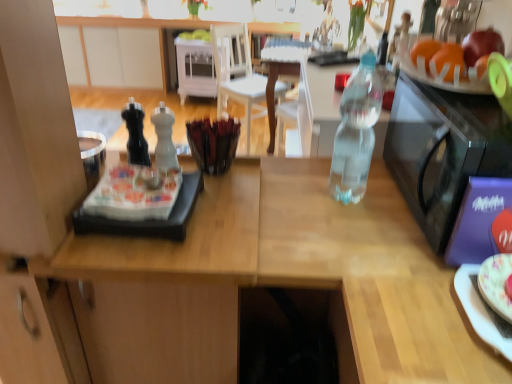
Question: From a real-world perspective, is porcelain floral plate at right positioned above or below white wood chair at center?

Choices:
 (A) above
 (B) below

Answer: (A)

Question: Considering the relative positions of porcelain floral plate at right and white wood chair at center in the image provided, is porcelain floral plate at right to the left or to the right of white wood chair at center?

Choices:
 (A) right
 (B) left

Answer: (A)

Question: Estimate the real-world distances between objects in this image. Which object is farther from the white matte pepper shaker at center, which is the second bottle in right-to-left order?

Choices:
 (A) white wood chair at center
 (B) shiny red apple at upper right
 (C) clear plastic bottle at center, which ranks as the 3th bottle in left-to-right order
 (D) transparent plastic microwave at right
 (E) white wood cabinet at center, positioned as the first cabinetry in right-to-left order

Answer: (E)

Question: Which is farther from the white matte cabinet at upper left, marked as the second cabinetry in a right-to-left arrangement?

Choices:
 (A) transparent plastic microwave at right
 (B) clear plastic bottle at center, acting as the 1th bottle starting from the right
 (C) shiny red apple at upper right
 (D) orange matte at upper right, placed as the second orange when sorted from back to front
 (E) orange matte at upper right, the 1th orange from the back

Answer: (D)